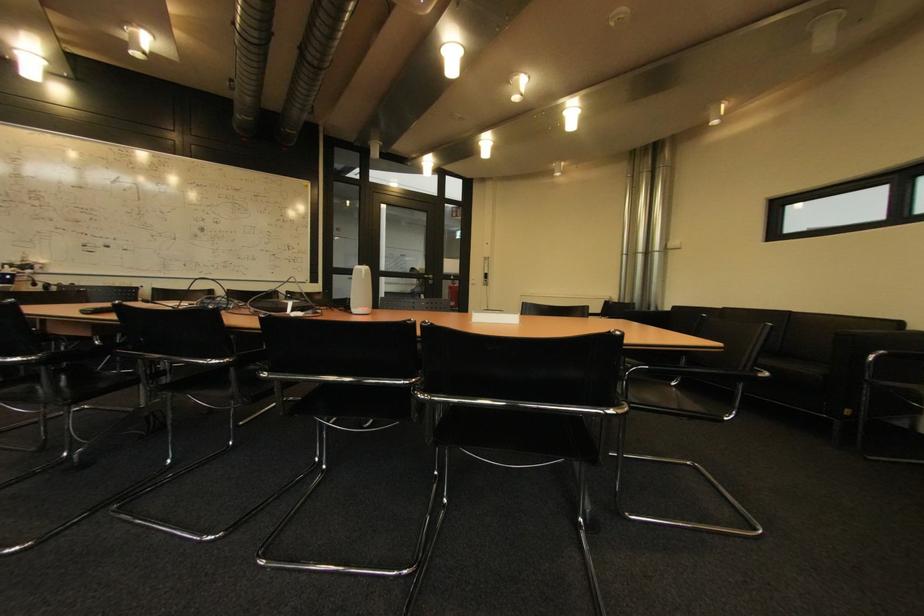
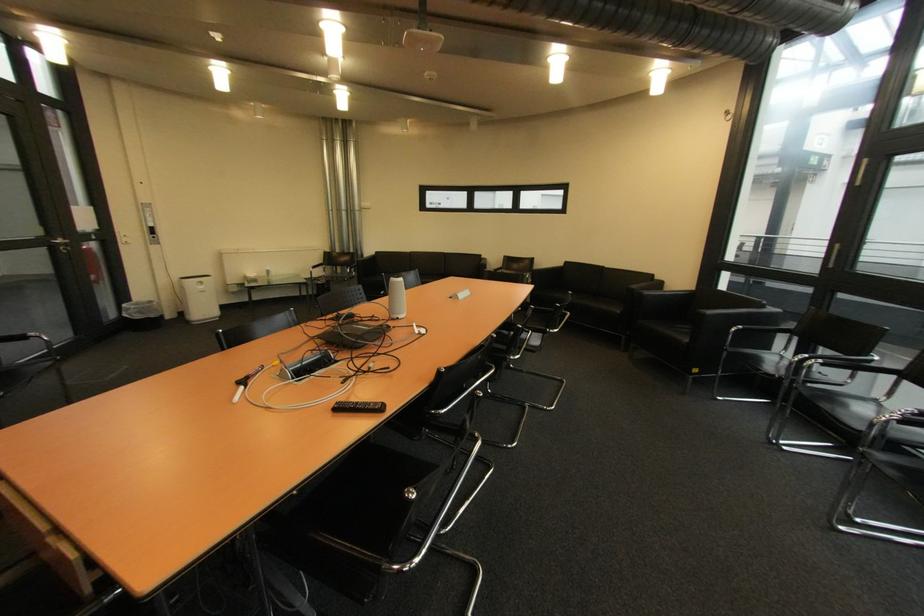
Find the pixel in the second image that matches pixel 439 278 in the first image.

(68, 241)